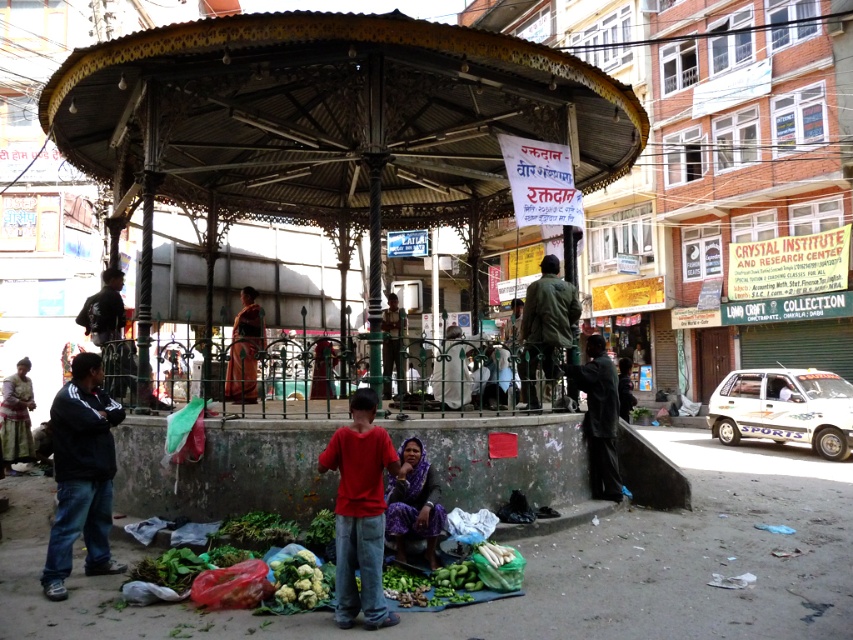
Question: Considering the relative positions of red cotton shirt at center and orange fabric cloth at center in the image provided, where is red cotton shirt at center located with respect to orange fabric cloth at center?

Choices:
 (A) right
 (B) left

Answer: (A)

Question: Which object is positioned closest to the black matte jacket at lower left?

Choices:
 (A) red cotton shirt at center
 (B) green matte jacket at center
 (C) green fabric skirt at lower left
 (D) printed fabric dress at center

Answer: (A)

Question: Is black matte jacket at lower left behind green matte jacket at center?

Choices:
 (A) no
 (B) yes

Answer: (A)

Question: Which object appears closest to the camera in this image?

Choices:
 (A) dark green jacket at left
 (B) green fabric skirt at lower left
 (C) printed fabric dress at center
 (D) metallic gazebo at center

Answer: (C)

Question: Is green matte jacket at center behind green fabric skirt at lower left?

Choices:
 (A) no
 (B) yes

Answer: (A)

Question: Which object is positioned farthest from the green fabric skirt at lower left?

Choices:
 (A) dark green jacket at left
 (B) metallic gazebo at center

Answer: (B)